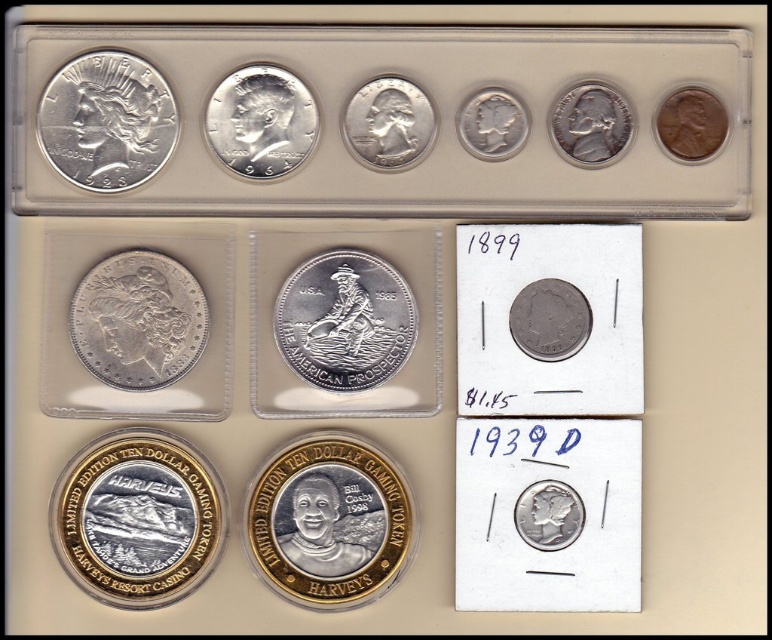
Question: Considering the real-world distances, which object is closest to the silver/smooth american prospector at center?

Choices:
 (A) satin silver coin at upper right
 (B) silver/gold plated coin at center-right

Answer: (B)

Question: Which point appears closest to the camera in this image?

Choices:
 (A) (330, 321)
 (B) (496, 99)
 (C) (401, 525)

Answer: (C)

Question: Does shiny silver coin at upper left have a lesser width compared to silver/smooth/quarter at upper center?

Choices:
 (A) no
 (B) yes

Answer: (A)

Question: Which object appears farthest from the camera in this image?

Choices:
 (A) satin silver coin at upper right
 (B) brown copper penny at upper right
 (C) silver/gold plated coin at center-right

Answer: (B)

Question: Can you confirm if gold plated coin at center is positioned to the left of silver/smooth american prospector at center?

Choices:
 (A) yes
 (B) no

Answer: (A)

Question: From the image, what is the correct spatial relationship of satin silver coin at upper center in relation to matte silver coin at center?

Choices:
 (A) above
 (B) below

Answer: (A)